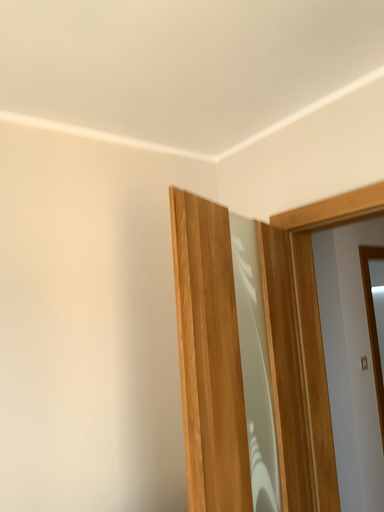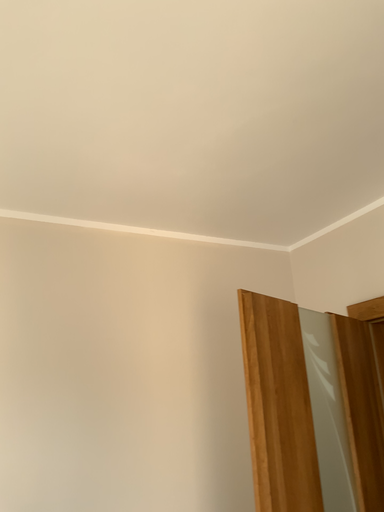
Question: Which way did the camera rotate in the video?

Choices:
 (A) rotated upward
 (B) rotated downward

Answer: (A)